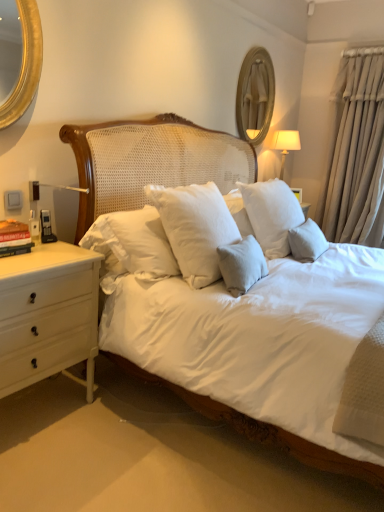
Image resolution: width=384 pixels, height=512 pixels. Describe the element at coordinates (14, 238) in the screenshot. I see `hardcover book at left` at that location.

The image size is (384, 512). What do you see at coordinates (355, 152) in the screenshot?
I see `beige fabric curtain at right` at bounding box center [355, 152].

Identify the location of hardcover book at left. (14, 238).

Can you tell me how much beige fabric curtain at right and white fabric lampshade at upper right differ in facing direction?

The facing directions of beige fabric curtain at right and white fabric lampshade at upper right are 90.3 degrees apart.

Is white fabric lampshade at upper right located within beige fabric curtain at right?

Actually, white fabric lampshade at upper right is outside beige fabric curtain at right.

From the image's perspective, would you say beige fabric curtain at right is shown under white fabric lampshade at upper right?

No, from the image's perspective, beige fabric curtain at right is not beneath white fabric lampshade at upper right.

Is beige fabric curtain at right positioned with its back to white fabric lampshade at upper right?

No, beige fabric curtain at right is not facing the opposite direction of white fabric lampshade at upper right.

How many degrees apart are the facing directions of hardcover book at left and beige fabric curtain at right?

The angular difference between hardcover book at left and beige fabric curtain at right is 90.3 degrees.

Does hardcover book at left contain beige fabric curtain at right?

No, beige fabric curtain at right is located outside of hardcover book at left.

From a real-world perspective, which object rests below the other?

From a 3D spatial view, hardcover book at left is below.

In the image, there is a beige fabric curtain at right. Identify the location of book below it (from a real-world perspective). (14, 238).

Is hardcover book at left looking in the opposite direction of wooden framed mirror at upper center?

hardcover book at left does not have its back to wooden framed mirror at upper center.

From the image's perspective, which is below, hardcover book at left or wooden framed mirror at upper center?

hardcover book at left.

Which is less distant, [24,252] or [271,114]?

Positioned in front is point [24,252].

Is beige fabric curtain at right directly adjacent to wooden framed mirror at upper center?

beige fabric curtain at right is not next to wooden framed mirror at upper center, and they're not touching.

Locate an element on the screen. The width and height of the screenshot is (384, 512). curtain that appears on the right of wooden framed mirror at upper center is located at coordinates (355, 152).

Considering the relative sizes of beige fabric curtain at right and wooden framed mirror at upper center in the image provided, is beige fabric curtain at right smaller than wooden framed mirror at upper center?

Incorrect, beige fabric curtain at right is not smaller in size than wooden framed mirror at upper center.

Is point (337, 151) more distant than point (249, 127)?

No, it is not.

Do you think white fabric lampshade at upper right is within beige fabric curtain at right, or outside of it?

white fabric lampshade at upper right is located beyond the bounds of beige fabric curtain at right.

How distant is white fabric lampshade at upper right from beige fabric curtain at right?

white fabric lampshade at upper right and beige fabric curtain at right are 71.10 centimeters apart from each other.

From a real-world perspective, is white fabric lampshade at upper right physically located above or below beige fabric curtain at right?

In terms of real-world spatial position, white fabric lampshade at upper right is below beige fabric curtain at right.

Considering the relative sizes of white fabric lampshade at upper right and beige fabric curtain at right in the image provided, is white fabric lampshade at upper right thinner than beige fabric curtain at right?

Indeed, white fabric lampshade at upper right has a lesser width compared to beige fabric curtain at right.

Which is closer to the camera, (379, 208) or (1, 251)?

Point (1, 251)

In the scene shown: Would you say beige fabric curtain at right is outside hardcover book at left?

Yes.

Is beige fabric curtain at right facing away from hardcover book at left?

beige fabric curtain at right is not turned away from hardcover book at left.

From a real-world perspective, is beige fabric curtain at right physically located above or below hardcover book at left?

From a real-world perspective, beige fabric curtain at right is physically above hardcover book at left.

Is wooden framed mirror at upper center oriented away from hardcover book at left?

wooden framed mirror at upper center is not turned away from hardcover book at left.

From the image's perspective, is wooden framed mirror at upper center below hardcover book at left?

No.

Is hardcover book at left inside wooden framed mirror at upper center?

Definitely not — hardcover book at left is not inside wooden framed mirror at upper center.

Considering the positions of objects wooden framed mirror at upper center and hardcover book at left in the image provided, who is more to the left, wooden framed mirror at upper center or hardcover book at left?

hardcover book at left is more to the left.

What are the coordinates of `bedside lamp below the beige fabric curtain at right (from the image's perspective)` in the screenshot? It's located at pos(285,144).

At what (x,y) coordinates should I click in order to perform the action: click on book in front of the beige fabric curtain at right. Please return your answer as a coordinate pair (x, y). Looking at the image, I should click on (14, 238).

Looking at the image, which one is located closer to white fabric lampshade at upper right, beige fabric curtain at right or wooden framed mirror at upper center?

Among the two, wooden framed mirror at upper center is located nearer to white fabric lampshade at upper right.

Considering their positions, is wooden framed mirror at upper center positioned closer to hardcover book at left than white fabric lampshade at upper right?

white fabric lampshade at upper right lies closer to hardcover book at left than the other object.

Looking at the image, which one is located further to beige fabric curtain at right, white fabric lampshade at upper right or wooden framed mirror at upper center?

wooden framed mirror at upper center lies further to beige fabric curtain at right than the other object.

Considering their positions, is hardcover book at left positioned further to beige fabric curtain at right than white fabric lampshade at upper right?

hardcover book at left is positioned further to the anchor beige fabric curtain at right.

When comparing their distances from wooden framed mirror at upper center, does beige fabric curtain at right or white fabric lampshade at upper right seem further?

beige fabric curtain at right lies further to wooden framed mirror at upper center than the other object.

Based on their spatial positions, is white fabric lampshade at upper right or wooden framed mirror at upper center further from hardcover book at left?

The object further to hardcover book at left is wooden framed mirror at upper center.

Looking at the image, which one is located closer to wooden framed mirror at upper center, white fabric lampshade at upper right or hardcover book at left?

white fabric lampshade at upper right lies closer to wooden framed mirror at upper center than the other object.

Based on their spatial positions, is wooden framed mirror at upper center or beige fabric curtain at right further from hardcover book at left?

beige fabric curtain at right is further to hardcover book at left.

Find the location of a particular element. mirror located between hardcover book at left and beige fabric curtain at right in the left-right direction is located at coordinates (255, 95).

Find the location of `bedside lamp between hardcover book at left and beige fabric curtain at right from left to right`. bedside lamp between hardcover book at left and beige fabric curtain at right from left to right is located at coordinates (285, 144).

You are a GUI agent. You are given a task and a screenshot of the screen. Output one action in this format:
    pyautogui.click(x=<x>, y=<y>)
    Task: Click on the bedside lamp situated between wooden framed mirror at upper center and beige fabric curtain at right from left to right
    
    Given the screenshot: What is the action you would take?
    pyautogui.click(x=285, y=144)

This screenshot has width=384, height=512. Identify the location of mirror positioned between hardcover book at left and white fabric lampshade at upper right from near to far. (255, 95).